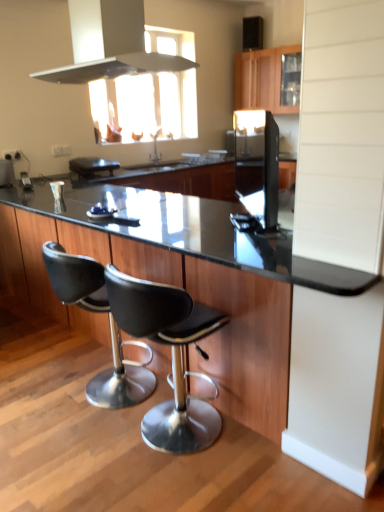
Question: Does black glass countertop at center, which ranks as the second countertop in left-to-right order, have a lesser width compared to black leather stool at center, which is counted as the first chair, starting from the right?

Choices:
 (A) no
 (B) yes

Answer: (A)

Question: Does black glass countertop at center, placed as the 1th countertop when sorted from right to left, lie in front of black leather stool at center, which is counted as the first chair, starting from the right?

Choices:
 (A) no
 (B) yes

Answer: (A)

Question: Is black glass countertop at center, which ranks as the second countertop in left-to-right order, behind black leather stool at center, which is counted as the first chair, starting from the right?

Choices:
 (A) no
 (B) yes

Answer: (B)

Question: Considering the relative sizes of black glass countertop at center, placed as the 1th countertop when sorted from right to left, and black leather stool at center, which appears as the second chair when viewed from the left, in the image provided, is black glass countertop at center, placed as the 1th countertop when sorted from right to left, bigger than black leather stool at center, which appears as the second chair when viewed from the left,?

Choices:
 (A) no
 (B) yes

Answer: (B)

Question: Is black glass countertop at center, which ranks as the second countertop in left-to-right order, positioned with its back to black leather stool at center, which appears as the second chair when viewed from the left?

Choices:
 (A) no
 (B) yes

Answer: (A)

Question: In terms of width, does metallic silver exhaust hood at upper center look wider or thinner when compared to black glossy refrigerator at center, which is the first appliance in right-to-left order?

Choices:
 (A) thin
 (B) wide

Answer: (B)

Question: Is point pos(155,55) positioned closer to the camera than point pos(274,202)?

Choices:
 (A) farther
 (B) closer

Answer: (B)

Question: Which is correct: metallic silver exhaust hood at upper center is inside black glossy refrigerator at center, the 2th appliance from the top, or outside of it?

Choices:
 (A) inside
 (B) outside

Answer: (B)

Question: From the image's perspective, relative to black glossy refrigerator at center, arranged as the second appliance when viewed from the back, is metallic silver exhaust hood at upper center above or below?

Choices:
 (A) above
 (B) below

Answer: (A)

Question: Is black glass countertop at center, which ranks as the second countertop in left-to-right order, wider or thinner than black leather stool at center, placed as the first chair when sorted from left to right?

Choices:
 (A) thin
 (B) wide

Answer: (B)

Question: From a real-world perspective, relative to black leather stool at center, placed as the first chair when sorted from left to right, is black glass countertop at center, which ranks as the second countertop in left-to-right order, vertically above or below?

Choices:
 (A) below
 (B) above

Answer: (B)

Question: Is black glass countertop at center, which ranks as the second countertop in left-to-right order, to the left or to the right of black leather stool at center, positioned as the second chair in right-to-left order, in the image?

Choices:
 (A) left
 (B) right

Answer: (B)

Question: In the image, is black glass countertop at center, which ranks as the second countertop in left-to-right order, positioned in front of or behind black leather stool at center, positioned as the second chair in right-to-left order?

Choices:
 (A) front
 (B) behind

Answer: (A)

Question: From the image's perspective, is black leather stool at center, positioned as the second chair in right-to-left order, above or below metallic silver exhaust hood at upper center?

Choices:
 (A) above
 (B) below

Answer: (B)

Question: Is point (97, 381) closer or farther from the camera than point (34, 74)?

Choices:
 (A) closer
 (B) farther

Answer: (A)